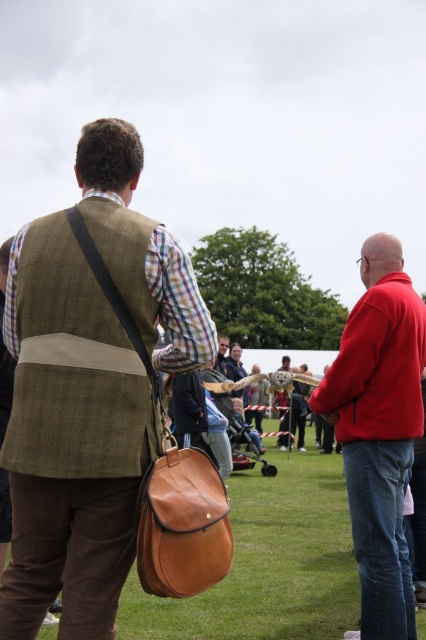
Question: Does matte brown vest at center lie behind green matte grass at lower center?

Choices:
 (A) yes
 (B) no

Answer: (B)

Question: Which of the following is the closest to the observer?

Choices:
 (A) matte brown vest at center
 (B) green matte grass at lower center

Answer: (A)

Question: Estimate the real-world distances between objects in this image. Which object is closer to the red fleece jacket at right?

Choices:
 (A) matte brown vest at center
 (B) green matte grass at lower center

Answer: (A)

Question: Which object is the closest to the matte brown vest at center?

Choices:
 (A) green matte grass at lower center
 (B) red fleece jacket at right

Answer: (B)

Question: Considering the relative positions of matte brown vest at center and red fleece jacket at right in the image provided, where is matte brown vest at center located with respect to red fleece jacket at right?

Choices:
 (A) left
 (B) right

Answer: (A)

Question: Can you confirm if matte brown vest at center is positioned above green matte grass at lower center?

Choices:
 (A) no
 (B) yes

Answer: (B)